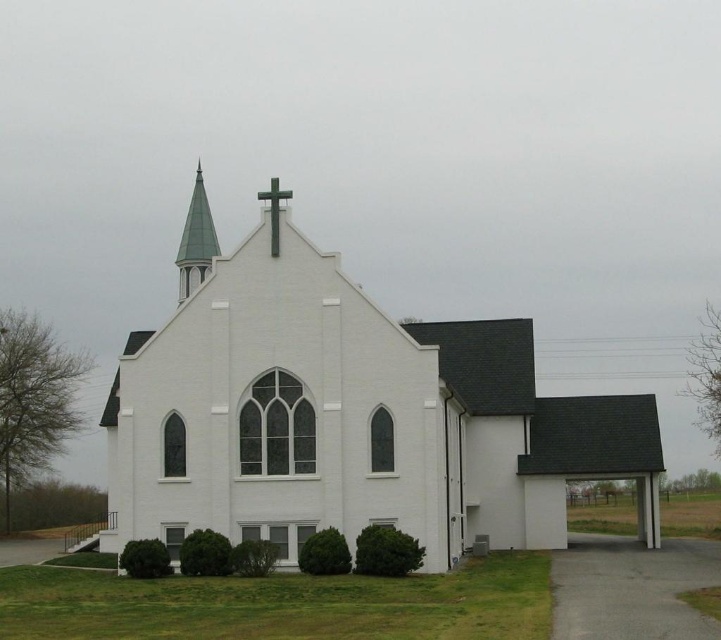
Question: Considering the relative positions of white matte church at center and green metallic spire at upper center in the image provided, where is white matte church at center located with respect to green metallic spire at upper center?

Choices:
 (A) below
 (B) above

Answer: (A)

Question: Is white matte church at center closer to the viewer compared to green matte cross at upper center?

Choices:
 (A) no
 (B) yes

Answer: (B)

Question: Which of the following is the farthest from the observer?

Choices:
 (A) (278, 198)
 (B) (182, 237)

Answer: (B)

Question: Which object is closer to the camera taking this photo?

Choices:
 (A) green matte cross at upper center
 (B) white matte church at center
 (C) green metallic spire at upper center

Answer: (B)

Question: Does white matte church at center appear over green matte cross at upper center?

Choices:
 (A) no
 (B) yes

Answer: (A)

Question: Which point is farther from the camera taking this photo?

Choices:
 (A) (332, 323)
 (B) (273, 182)

Answer: (B)